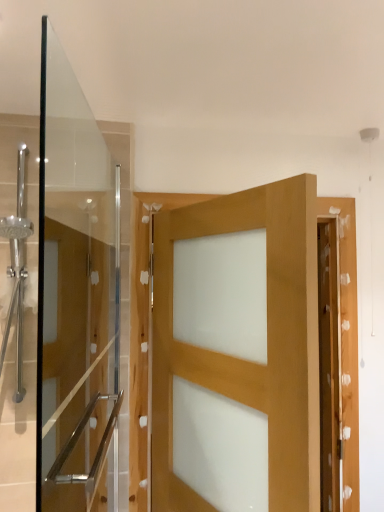
Question: Considering the relative sizes of natural wood door at center and clear glass door at left in the image provided, is natural wood door at center bigger than clear glass door at left?

Choices:
 (A) yes
 (B) no

Answer: (A)

Question: Considering the relative sizes of natural wood door at center and clear glass door at left in the image provided, is natural wood door at center thinner than clear glass door at left?

Choices:
 (A) yes
 (B) no

Answer: (B)

Question: Does natural wood door at center have a greater width compared to clear glass door at left?

Choices:
 (A) yes
 (B) no

Answer: (A)

Question: Considering the relative sizes of natural wood door at center and clear glass door at left in the image provided, is natural wood door at center shorter than clear glass door at left?

Choices:
 (A) yes
 (B) no

Answer: (A)

Question: From a real-world perspective, is natural wood door at center over clear glass door at left?

Choices:
 (A) yes
 (B) no

Answer: (B)

Question: Does natural wood door at center lie behind clear glass door at left?

Choices:
 (A) no
 (B) yes

Answer: (B)

Question: From the image's perspective, would you say clear glass door at left is shown under natural wood door at center?

Choices:
 (A) yes
 (B) no

Answer: (B)

Question: Is clear glass door at left further to camera compared to natural wood door at center?

Choices:
 (A) no
 (B) yes

Answer: (A)

Question: Is clear glass door at left far away from natural wood door at center?

Choices:
 (A) yes
 (B) no

Answer: (B)

Question: Is clear glass door at left looking in the opposite direction of natural wood door at center?

Choices:
 (A) no
 (B) yes

Answer: (B)

Question: From a real-world perspective, is clear glass door at left on natural wood door at center?

Choices:
 (A) no
 (B) yes

Answer: (B)

Question: Considering the relative sizes of clear glass door at left and natural wood door at center in the image provided, is clear glass door at left wider than natural wood door at center?

Choices:
 (A) no
 (B) yes

Answer: (A)

Question: Considering the positions of clear glass door at left and natural wood door at center in the image, is clear glass door at left wider or thinner than natural wood door at center?

Choices:
 (A) wide
 (B) thin

Answer: (B)